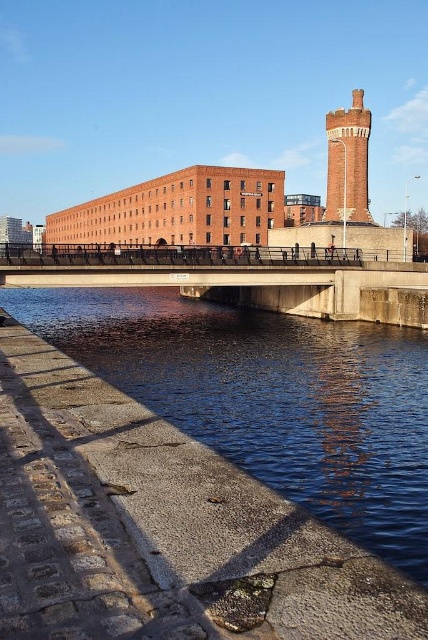
The height and width of the screenshot is (640, 428). What do you see at coordinates (269, 397) in the screenshot?
I see `blue concrete river at lower left` at bounding box center [269, 397].

Is blue concrete river at lower left wider than red brick tower at upper right?

Correct, the width of blue concrete river at lower left exceeds that of red brick tower at upper right.

Is point (273, 342) closer to viewer compared to point (338, 173)?

Yes, it is in front of point (338, 173).

Locate an element on the screen. blue concrete river at lower left is located at coordinates (269, 397).

Who is taller, blue concrete river at lower left or concrete bridge at center?

blue concrete river at lower left is taller.

Is point (169, 403) farther from camera compared to point (190, 257)?

No, it is not.

Describe the element at coordinates (269, 397) in the screenshot. I see `blue concrete river at lower left` at that location.

Identify the location of blue concrete river at lower left. (269, 397).

Describe the element at coordinates (234, 275) in the screenshot. Image resolution: width=428 pixels, height=640 pixels. I see `concrete bridge at center` at that location.

Consider the image. Does concrete bridge at center appear on the right side of red brick tower at upper right?

Incorrect, concrete bridge at center is not on the right side of red brick tower at upper right.

Find the location of a particular element. Image resolution: width=428 pixels, height=640 pixels. concrete bridge at center is located at coordinates (234, 275).